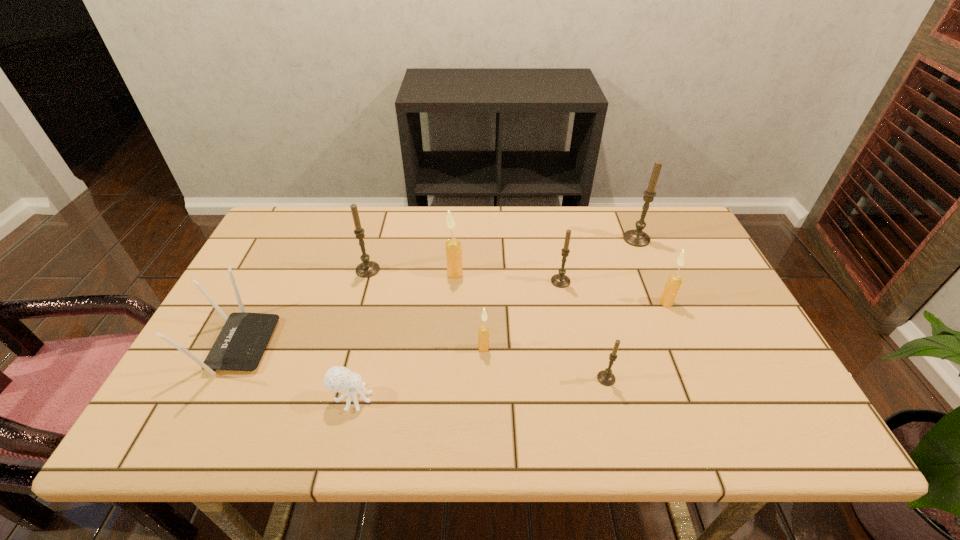
Find the location of `cream candle object that ranks as the closest to the fourth object from right to left`. cream candle object that ranks as the closest to the fourth object from right to left is located at coordinates (674, 281).

Image resolution: width=960 pixels, height=540 pixels. In order to click on cream candle that is the third closest one to the biggest gray candle in this screenshot , I will do `click(483, 333)`.

Identify the location of vacant space that satisfies the following two spatial constraints: 1. on the front side of the fifth candle from left to right; 2. on the left side of the third gray candle from right to left. (579, 379).

Image resolution: width=960 pixels, height=540 pixels. I want to click on vacant space that satisfies the following two spatial constraints: 1. on the front side of the second biggest gray candle; 2. on the left side of the third candle from right to left, so click(x=338, y=379).

Identify the location of vacant region that satisfies the following two spatial constraints: 1. on the front side of the leftmost cream candle; 2. on the front-facing side of the router. This screenshot has height=540, width=960. (450, 345).

Where is `vacant space that satisfies the following two spatial constraints: 1. on the back side of the tallest candle; 2. on the right side of the fourth candle from left to right`? The height and width of the screenshot is (540, 960). vacant space that satisfies the following two spatial constraints: 1. on the back side of the tallest candle; 2. on the right side of the fourth candle from left to right is located at coordinates (552, 239).

Find the location of a particular element. The width and height of the screenshot is (960, 540). free space that satisfies the following two spatial constraints: 1. on the back side of the nearest candle; 2. on the front-facing side of the router is located at coordinates (598, 345).